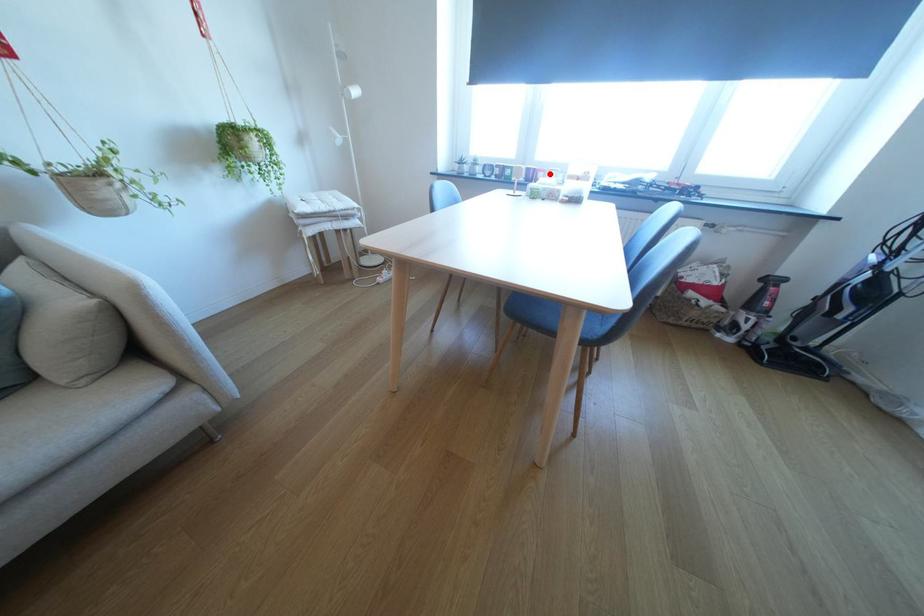
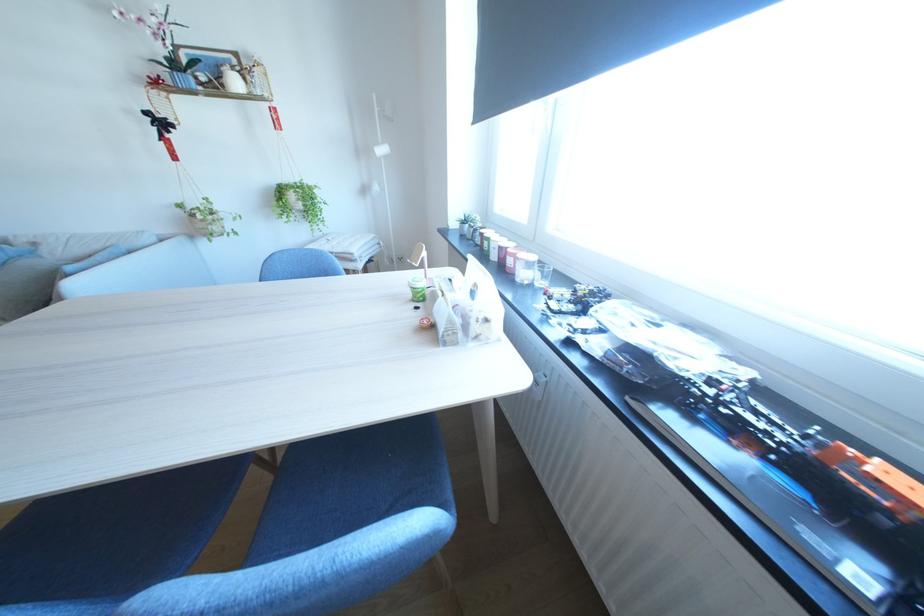
The point at the highlighted location is marked in the first image. Where is the corresponding point in the second image?

(518, 257)